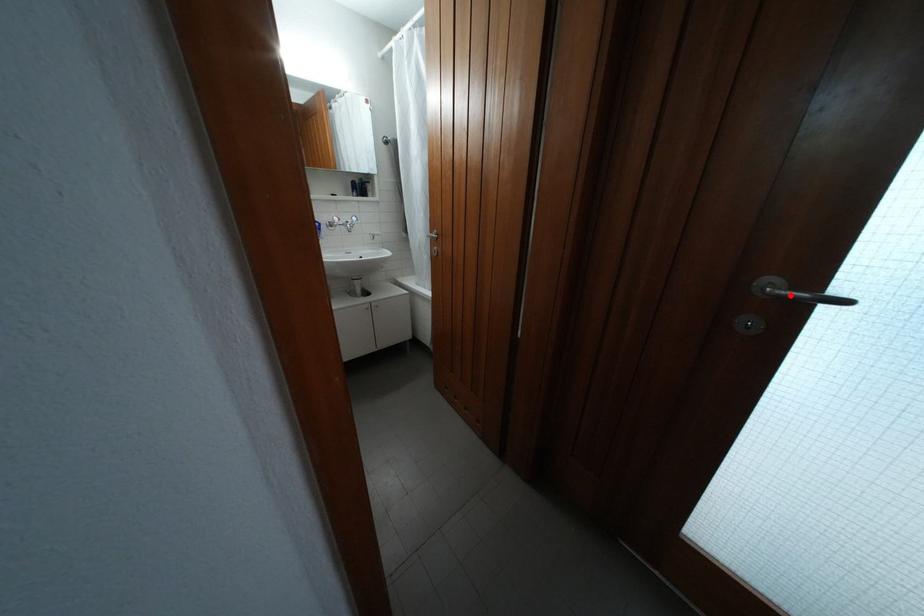
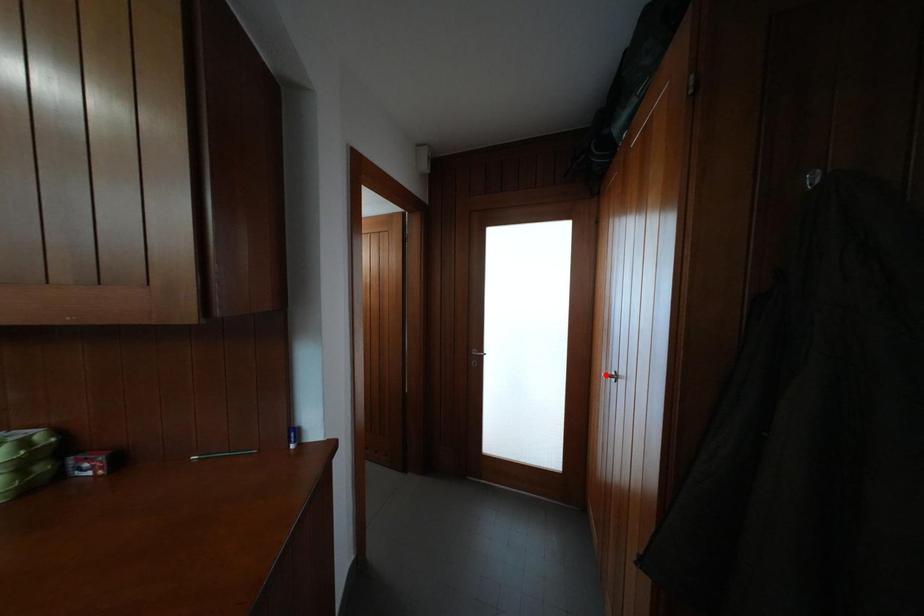
I am providing you with two images of the same scene from different viewpoints. A red point is marked on the first image and another point is marked on the second image. Is the red point in image1 aligned with the point shown in image2?

No